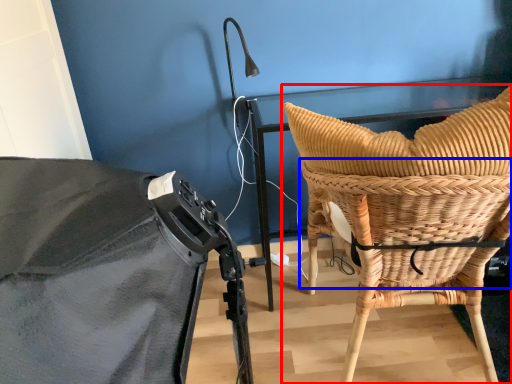
Question: Which object appears closest to the camera in this image, chair (highlighted by a red box) or basket (highlighted by a blue box)?

Choices:
 (A) chair
 (B) basket

Answer: (A)